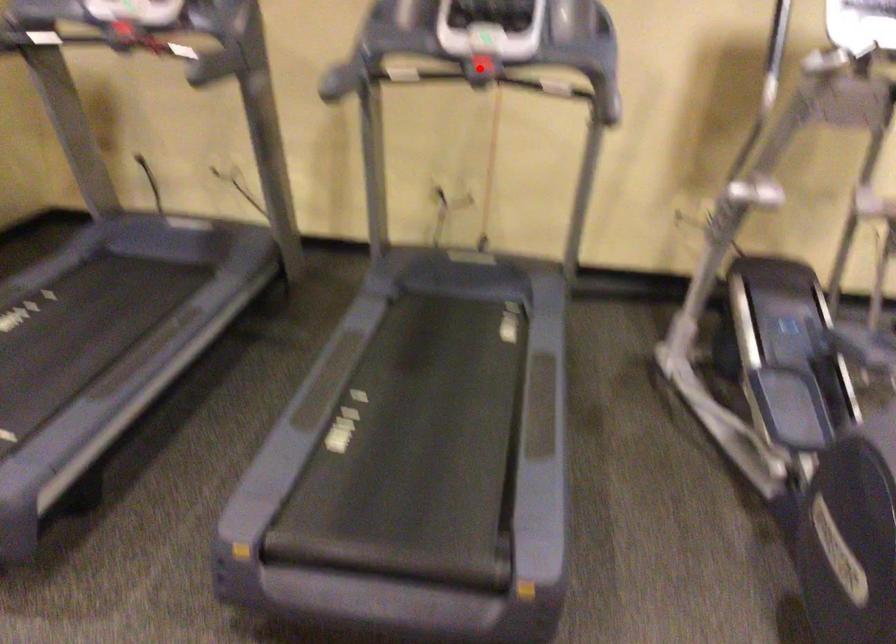
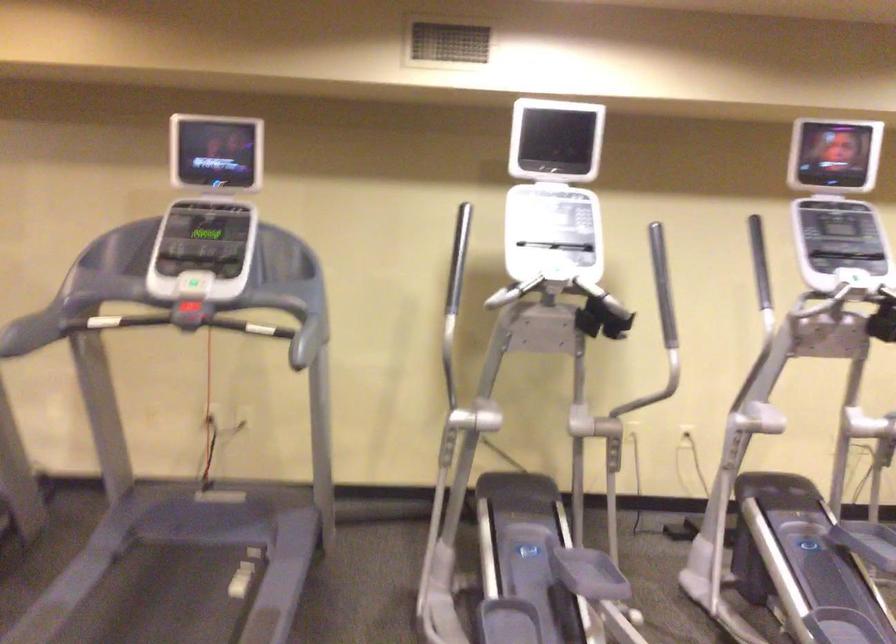
In the second image, find the point that corresponds to the highlighted location in the first image.

(187, 321)